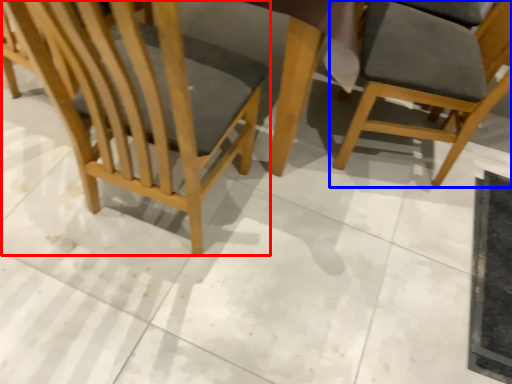
Question: Which point is closer to the camera, chair (highlighted by a red box) or chair (highlighted by a blue box)?

Choices:
 (A) chair
 (B) chair

Answer: (A)